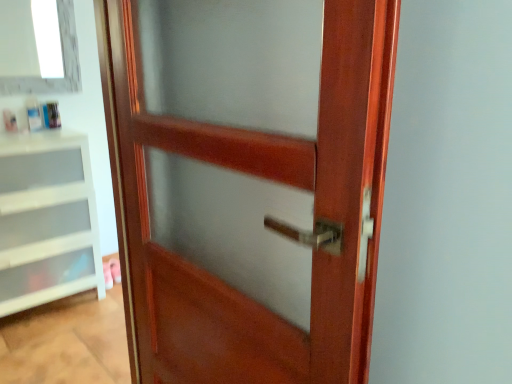
Question: Is mahogany wood door at center facing towards white plastic drawer at left?

Choices:
 (A) no
 (B) yes

Answer: (A)

Question: From the image's perspective, is mahogany wood door at center on top of white plastic drawer at left?

Choices:
 (A) yes
 (B) no

Answer: (B)

Question: Is mahogany wood door at center outside of white plastic drawer at left?

Choices:
 (A) no
 (B) yes

Answer: (B)

Question: Are mahogany wood door at center and white plastic drawer at left located far from each other?

Choices:
 (A) yes
 (B) no

Answer: (A)

Question: From the image's perspective, does mahogany wood door at center appear lower than white plastic drawer at left?

Choices:
 (A) no
 (B) yes

Answer: (B)

Question: Is mahogany wood door at center wider or thinner than white glass window at upper left?

Choices:
 (A) wide
 (B) thin

Answer: (A)

Question: From a real-world perspective, relative to white glass window at upper left, is mahogany wood door at center vertically above or below?

Choices:
 (A) above
 (B) below

Answer: (B)

Question: From their relative heights in the image, would you say mahogany wood door at center is taller or shorter than white glass window at upper left?

Choices:
 (A) tall
 (B) short

Answer: (A)

Question: Is mahogany wood door at center in front of or behind white glass window at upper left in the image?

Choices:
 (A) front
 (B) behind

Answer: (A)

Question: Which is correct: white plastic drawer at left is inside mahogany wood door at center, or outside of it?

Choices:
 (A) inside
 (B) outside

Answer: (B)

Question: Considering their positions, is white plastic drawer at left located in front of or behind mahogany wood door at center?

Choices:
 (A) front
 (B) behind

Answer: (B)

Question: Is white plastic drawer at left bigger or smaller than mahogany wood door at center?

Choices:
 (A) big
 (B) small

Answer: (A)

Question: From a real-world perspective, relative to mahogany wood door at center, is white plastic drawer at left vertically above or below?

Choices:
 (A) above
 (B) below

Answer: (B)

Question: Based on their positions, is white plastic drawer at left located to the left or right of white glass window at upper left?

Choices:
 (A) left
 (B) right

Answer: (A)

Question: From a real-world perspective, is white plastic drawer at left physically located above or below white glass window at upper left?

Choices:
 (A) below
 (B) above

Answer: (A)